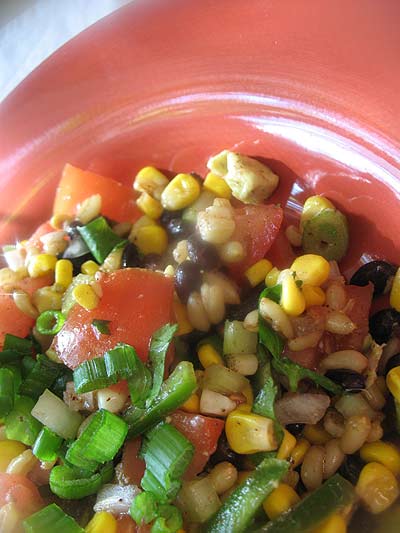
I want to click on plate, so click(251, 115).